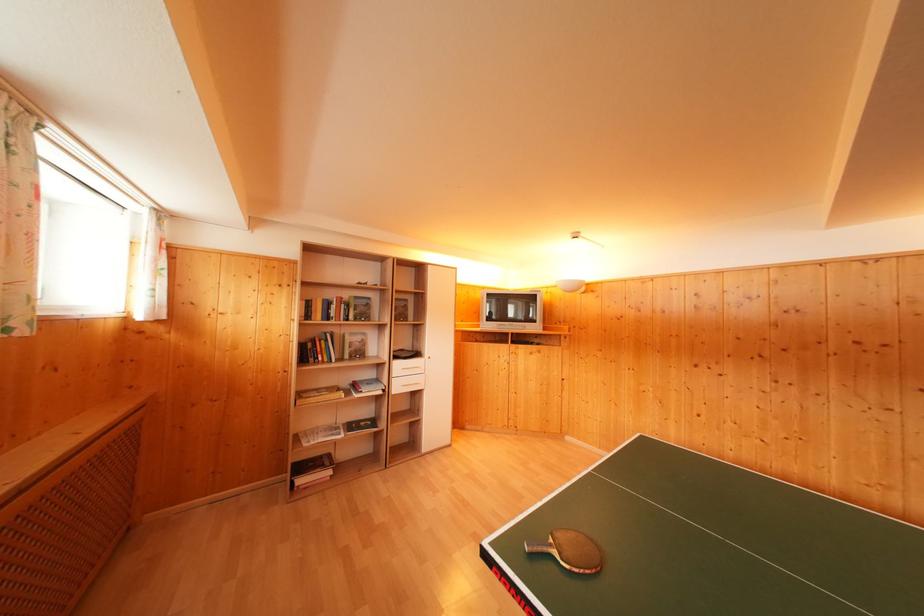
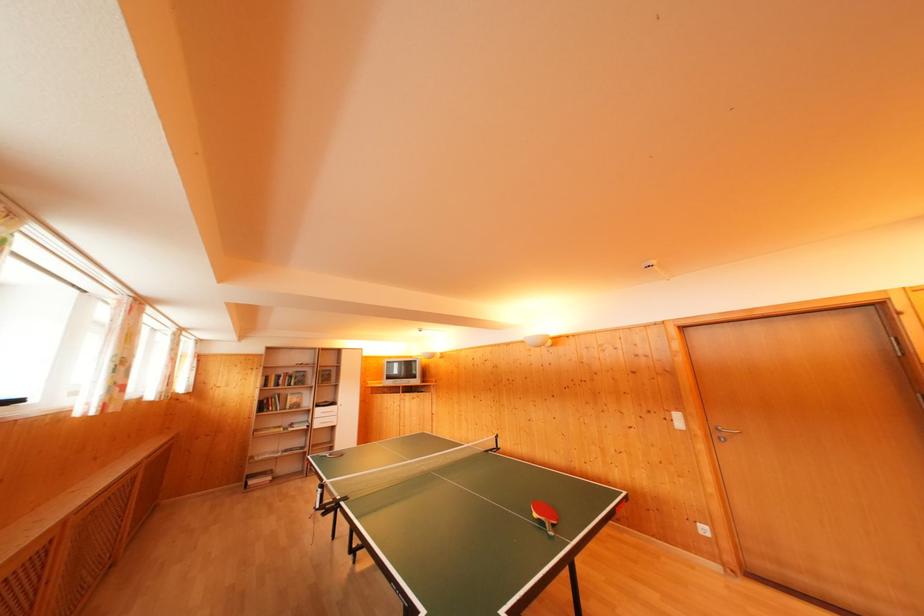
Where in the second image is the point corresponding to the point at 335,300 from the first image?

(286, 377)